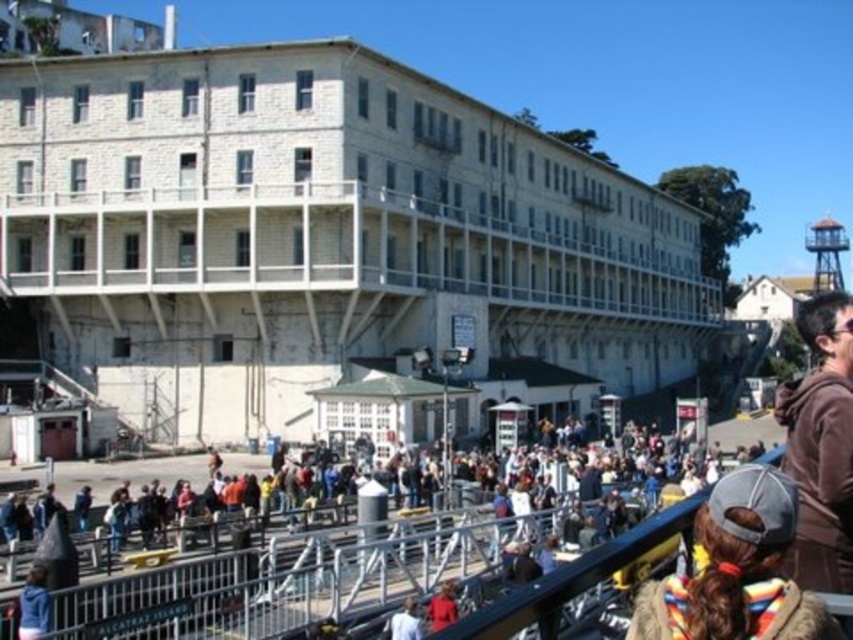
Question: Is multicolored fur coat at lower right wider than brown fuzzy jacket at right?

Choices:
 (A) no
 (B) yes

Answer: (A)

Question: From the image, what is the correct spatial relationship of multicolored fur coat at lower right in relation to brown fuzzy jacket at right?

Choices:
 (A) below
 (B) above

Answer: (A)

Question: Which point is closer to the camera taking this photo?

Choices:
 (A) (772, 508)
 (B) (849, 444)

Answer: (A)

Question: Is multicolored fur coat at lower right to the right of brown fuzzy jacket at right from the viewer's perspective?

Choices:
 (A) yes
 (B) no

Answer: (B)

Question: Which point is closer to the camera?

Choices:
 (A) (779, 609)
 (B) (801, 465)

Answer: (A)